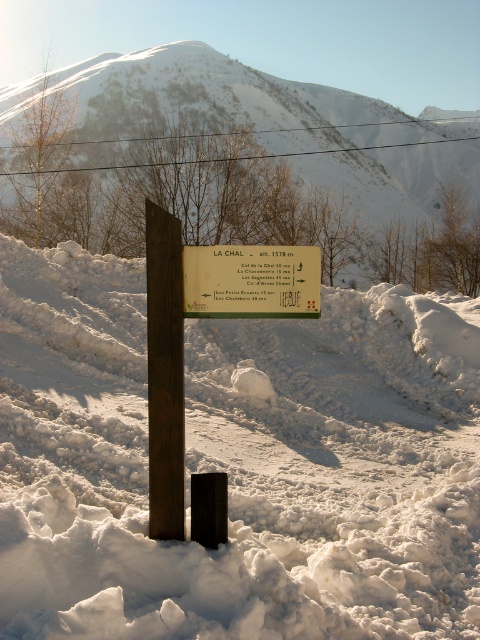
Question: Which point is farther to the camera?

Choices:
 (A) white snow at center
 (B) white plastic sign at center

Answer: (B)

Question: Can you confirm if white snow at center is positioned to the left of white snow-covered mountain at upper center?

Choices:
 (A) yes
 (B) no

Answer: (A)

Question: Is white snow at center further to camera compared to white plastic sign at center?

Choices:
 (A) no
 (B) yes

Answer: (A)

Question: Does white snow at center appear under rusty wood post at center?

Choices:
 (A) yes
 (B) no

Answer: (A)

Question: Which point is closer to the camera?

Choices:
 (A) (176, 524)
 (B) (478, 234)

Answer: (A)

Question: Which point appears closest to the camera in this image?

Choices:
 (A) (151, 497)
 (B) (259, 282)
 (C) (24, 264)

Answer: (A)